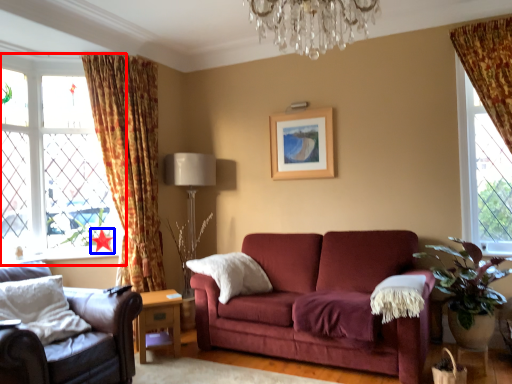
Question: Which of the following is the closest to the observer, window (highlighted by a red box) or star (highlighted by a blue box)?

Choices:
 (A) window
 (B) star

Answer: (A)